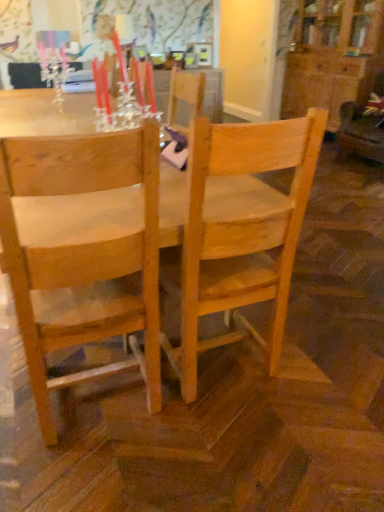
Measure the distance between natural wood table at center and camera.

natural wood table at center is 38.22 inches away from camera.

This screenshot has width=384, height=512. What do you see at coordinates (232, 226) in the screenshot? I see `natural wood table at center` at bounding box center [232, 226].

Measure the distance between point (190, 343) and camera.

Point (190, 343) and camera are 5.13 feet apart.

This screenshot has height=512, width=384. What do you see at coordinates (364, 125) in the screenshot?
I see `velvet brown swivel chair at right` at bounding box center [364, 125].

Locate an element on the screen. The height and width of the screenshot is (512, 384). natural wood chair at left, which is the 1th chair from left to right is located at coordinates (81, 251).

Locate an element on the screen. The image size is (384, 512). matte glass candle holder at upper left is located at coordinates (53, 63).

From the image's perspective, which is above, natural wood table at center or natural wood chair at center, which is the second chair from left to right?

natural wood table at center, from the image's perspective.

Considering the positions of objects natural wood table at center and natural wood chair at center, positioned as the first chair in right-to-left order, in the image provided, who is more to the left, natural wood table at center or natural wood chair at center, positioned as the first chair in right-to-left order,?

natural wood table at center.

Which object is more forward, natural wood table at center or natural wood chair at center, positioned as the first chair in right-to-left order?

natural wood chair at center, positioned as the first chair in right-to-left order.

Does natural wood table at center turn towards natural wood chair at center, which is the second chair from left to right?

Yes, natural wood table at center is oriented towards natural wood chair at center, which is the second chair from left to right.

From the picture: Is natural wood table at center bigger or smaller than matte glass candle holder at upper left?

Clearly, natural wood table at center is larger in size than matte glass candle holder at upper left.

Who is more distant, natural wood table at center or matte glass candle holder at upper left?

matte glass candle holder at upper left is further from the camera.

Is natural wood table at center in contact with matte glass candle holder at upper left?

No, natural wood table at center is not next to matte glass candle holder at upper left.

Considering the positions of point (344, 127) and point (317, 158), is point (344, 127) closer or farther from the camera than point (317, 158)?

Point (344, 127) is positioned farther from the camera compared to point (317, 158).

Is natural wood chair at center, which is the second chair from left to right, surrounded by velvet brown swivel chair at right?

No.

Is natural wood chair at center, which is the second chair from left to right, at the back of velvet brown swivel chair at right?

No, natural wood chair at center, which is the second chair from left to right, is not at the back of velvet brown swivel chair at right.

Is velvet brown swivel chair at right next to natural wood chair at left, which ranks as the second chair in right-to-left order?

There is a gap between velvet brown swivel chair at right and natural wood chair at left, which ranks as the second chair in right-to-left order.

Locate an element on the screen. The image size is (384, 512). swivel chair above the natural wood chair at left, which is the 1th chair from left to right (from the image's perspective) is located at coordinates (364, 125).

In terms of width, does velvet brown swivel chair at right look wider or thinner when compared to natural wood chair at left, which ranks as the second chair in right-to-left order?

Considering their sizes, velvet brown swivel chair at right looks broader than natural wood chair at left, which ranks as the second chair in right-to-left order.

From the image's perspective, would you say velvet brown swivel chair at right is shown under natural wood chair at left, which ranks as the second chair in right-to-left order?

Incorrect, from the image's perspective, velvet brown swivel chair at right is higher than natural wood chair at left, which ranks as the second chair in right-to-left order.

Where is `swivel chair on the right of natural wood table at center`? The image size is (384, 512). swivel chair on the right of natural wood table at center is located at coordinates (364, 125).

How different are the orientations of velvet brown swivel chair at right and natural wood table at center in degrees?

The angle between the facing direction of velvet brown swivel chair at right and the facing direction of natural wood table at center is 180 degrees.

Who is smaller, velvet brown swivel chair at right or natural wood table at center?

Smaller between the two is velvet brown swivel chair at right.

Is velvet brown swivel chair at right to the left of natural wood table at center from the viewer's perspective?

No.

Can you tell me how much matte glass candle holder at upper left and natural wood table at center differ in facing direction?

The facing directions of matte glass candle holder at upper left and natural wood table at center are 0.787 degrees apart.

Between matte glass candle holder at upper left and natural wood table at center, which one has larger width?

Wider between the two is natural wood table at center.

Does matte glass candle holder at upper left touch natural wood table at center?

No, matte glass candle holder at upper left is not beside natural wood table at center.

Does matte glass candle holder at upper left appear on the left side of natural wood table at center?

Yes.

Is natural wood chair at center, positioned as the first chair in right-to-left order, with natural wood table at center?

Indeed, natural wood chair at center, positioned as the first chair in right-to-left order, and natural wood table at center are beside each other and touching.

Is natural wood chair at center, positioned as the first chair in right-to-left order, aimed at natural wood table at center?

Yes, natural wood chair at center, positioned as the first chair in right-to-left order, is facing natural wood table at center.

Who is bigger, natural wood chair at center, which is the second chair from left to right, or natural wood table at center?

Bigger between the two is natural wood table at center.

What's the angular difference between natural wood chair at center, positioned as the first chair in right-to-left order, and natural wood table at center's facing directions?

The angle between the facing direction of natural wood chair at center, positioned as the first chair in right-to-left order, and the facing direction of natural wood table at center is 91.9 degrees.

In order to click on kitchen & dining room table behind the natural wood chair at center, positioned as the first chair in right-to-left order in this screenshot , I will do `click(232, 226)`.

The width and height of the screenshot is (384, 512). I want to click on kitchen & dining room table located underneath the matte glass candle holder at upper left (from a real-world perspective), so click(x=232, y=226).

Looking at the image, which one is located closer to natural wood chair at center, which is the second chair from left to right, matte glass candle holder at upper left or natural wood table at center?

Among the two, natural wood table at center is located nearer to natural wood chair at center, which is the second chair from left to right.

Based on the photo, based on their spatial positions, is matte glass candle holder at upper left or natural wood table at center closer to natural wood chair at left, which is the 1th chair from left to right?

natural wood table at center.

Based on their spatial positions, is velvet brown swivel chair at right or natural wood table at center closer to matte glass candle holder at upper left?

natural wood table at center is closer to matte glass candle holder at upper left.

Looking at the image, which one is located closer to natural wood table at center, velvet brown swivel chair at right or natural wood chair at left, which is the 1th chair from left to right?

natural wood chair at left, which is the 1th chair from left to right, is positioned closer to the anchor natural wood table at center.

Looking at the image, which one is located further to natural wood chair at center, positioned as the first chair in right-to-left order, natural wood table at center or natural wood chair at left, which is the 1th chair from left to right?

natural wood chair at left, which is the 1th chair from left to right, is further to natural wood chair at center, positioned as the first chair in right-to-left order.

Estimate the real-world distances between objects in this image. Which object is further from natural wood chair at center, which is the second chair from left to right, natural wood table at center or matte glass candle holder at upper left?

matte glass candle holder at upper left is further to natural wood chair at center, which is the second chair from left to right.

Estimate the real-world distances between objects in this image. Which object is further from natural wood chair at left, which ranks as the second chair in right-to-left order, matte glass candle holder at upper left or natural wood chair at center, which is the second chair from left to right?

matte glass candle holder at upper left lies further to natural wood chair at left, which ranks as the second chair in right-to-left order, than the other object.

Estimate the real-world distances between objects in this image. Which object is further from natural wood chair at center, positioned as the first chair in right-to-left order, velvet brown swivel chair at right or matte glass candle holder at upper left?

velvet brown swivel chair at right lies further to natural wood chair at center, positioned as the first chair in right-to-left order, than the other object.

Locate an element on the screen. The image size is (384, 512). kitchen & dining room table positioned between natural wood chair at center, positioned as the first chair in right-to-left order, and matte glass candle holder at upper left from near to far is located at coordinates (232, 226).

In order to click on kitchen & dining room table positioned between natural wood chair at center, which is the second chair from left to right, and velvet brown swivel chair at right from near to far in this screenshot , I will do `click(232, 226)`.

Where is `kitchen & dining room table between matte glass candle holder at upper left and velvet brown swivel chair at right in the horizontal direction`? The width and height of the screenshot is (384, 512). kitchen & dining room table between matte glass candle holder at upper left and velvet brown swivel chair at right in the horizontal direction is located at coordinates (232, 226).

You are a GUI agent. You are given a task and a screenshot of the screen. Output one action in this format:
    pyautogui.click(x=<x>, y=<y>)
    Task: Click on the kitchen & dining room table between natural wood chair at left, which is the 1th chair from left to right, and velvet brown swivel chair at right from front to back
    
    Given the screenshot: What is the action you would take?
    pyautogui.click(x=232, y=226)